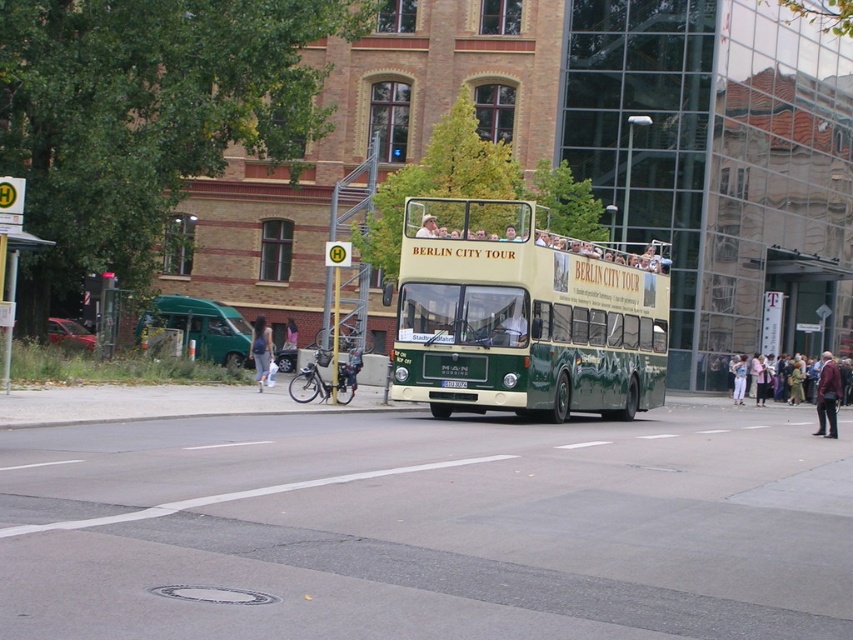
You are a photographer planning to take a closeup shot of the maroon leather jacket at lower right and denim pants at center. Which object should you focus on first if you want to capture both in the frame without moving the camera?

You should focus on the denim pants at center first because the maroon leather jacket at lower right occupies less space than the denim pants at center, meaning the jacket is smaller and might require adjusting the focus to ensure both fit properly.